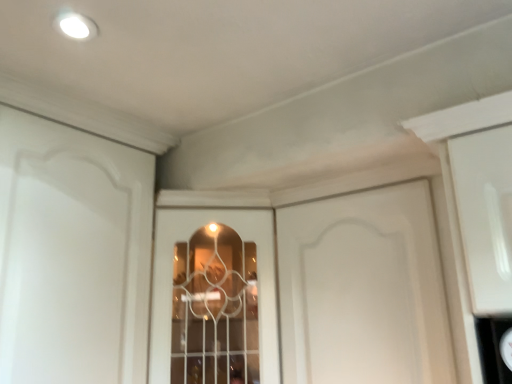
Locate an element on the screen. Image resolution: width=512 pixels, height=384 pixels. white matte cabinet door at center is located at coordinates (362, 290).

Describe the element at coordinates (362, 290) in the screenshot. I see `white matte cabinet door at center` at that location.

The image size is (512, 384). What do you see at coordinates (172, 286) in the screenshot?
I see `clear glass window at center` at bounding box center [172, 286].

At what (x,y) coordinates should I click in order to perform the action: click on clear glass window at center. Please return your answer as a coordinate pair (x, y). Looking at the image, I should click on (172, 286).

What is the approximate height of clear glass window at center?

27.46 inches.

I want to click on white matte cabinet door at center, so click(362, 290).

Is clear glass window at center at the left side of white matte cabinet door at center?

Yes.

Considering their positions, is clear glass window at center located in front of or behind white matte cabinet door at center?

In the image, clear glass window at center appears behind white matte cabinet door at center.

Between point (267, 374) and point (428, 339), which one is positioned in front?

The point (428, 339) is in front.

From the image's perspective, which object appears higher, clear glass window at center or white matte cabinet door at center?

white matte cabinet door at center appears higher in the image.

From a real-world perspective, is clear glass window at center on top of white matte cabinet door at center?

Incorrect, from a real-world perspective, clear glass window at center is lower than white matte cabinet door at center.

Considering the relative sizes of clear glass window at center and white matte cabinet door at center in the image provided, is clear glass window at center wider than white matte cabinet door at center?

Yes.

Considering the sizes of objects clear glass window at center and white matte cabinet door at center in the image provided, who is shorter, clear glass window at center or white matte cabinet door at center?

Standing shorter between the two is white matte cabinet door at center.

Is clear glass window at center smaller than white matte cabinet door at center?

No, clear glass window at center is not smaller than white matte cabinet door at center.

Would you say clear glass window at center is outside white matte cabinet door at center?

Yes, clear glass window at center is outside of white matte cabinet door at center.

Is there a large distance between clear glass window at center and white matte cabinet door at center?

That's not correct — clear glass window at center is a little close to white matte cabinet door at center.

From the picture: Is white matte cabinet door at center at the back of clear glass window at center?

No, clear glass window at center is not facing away from white matte cabinet door at center.

How different are the orientations of clear glass window at center and white matte cabinet door at center in degrees?

The facing directions of clear glass window at center and white matte cabinet door at center are 44.6 degrees apart.

Identify the location of door that appears on the right of clear glass window at center. The width and height of the screenshot is (512, 384). (362, 290).

Between white matte cabinet door at center and clear glass window at center, which one appears on the right side from the viewer's perspective?

Positioned to the right is white matte cabinet door at center.

Considering the positions of objects white matte cabinet door at center and clear glass window at center in the image provided, who is behind, white matte cabinet door at center or clear glass window at center?

clear glass window at center is behind.

Is point (436, 296) more distant than point (261, 350)?

No, (436, 296) is closer to viewer.

From the image's perspective, between white matte cabinet door at center and clear glass window at center, who is located below?

From the image's view, clear glass window at center is below.

From a real-world perspective, relative to clear glass window at center, is white matte cabinet door at center vertically above or below?

white matte cabinet door at center is situated higher than clear glass window at center in the real world.

Is white matte cabinet door at center wider than clear glass window at center?

Incorrect, the width of white matte cabinet door at center does not surpass that of clear glass window at center.

In terms of height, does white matte cabinet door at center look taller or shorter compared to clear glass window at center?

white matte cabinet door at center is shorter than clear glass window at center.

Which of these two, white matte cabinet door at center or clear glass window at center, is smaller?

With smaller size is white matte cabinet door at center.

Is white matte cabinet door at center inside the boundaries of clear glass window at center, or outside?

white matte cabinet door at center is not enclosed by clear glass window at center.

Is white matte cabinet door at center directly adjacent to clear glass window at center?

white matte cabinet door at center is not next to clear glass window at center, and they're not touching.

Is white matte cabinet door at center oriented towards clear glass window at center?

No, white matte cabinet door at center is not aimed at clear glass window at center.

What's the angular difference between white matte cabinet door at center and clear glass window at center's facing directions?

They differ by 44.6 degrees in their facing directions.

In the image, there is a clear glass window at center. Where is `door above it (from the image's perspective)`? The image size is (512, 384). door above it (from the image's perspective) is located at coordinates (362, 290).

You are a GUI agent. You are given a task and a screenshot of the screen. Output one action in this format:
    pyautogui.click(x=<x>, y=<y>)
    Task: Click on the window that is below the white matte cabinet door at center (from the image's perspective)
    This screenshot has height=384, width=512.
    Given the screenshot: What is the action you would take?
    pyautogui.click(x=172, y=286)

At what (x,y) coordinates should I click in order to perform the action: click on door to the right of clear glass window at center. Please return your answer as a coordinate pair (x, y). This screenshot has height=384, width=512. Looking at the image, I should click on (362, 290).